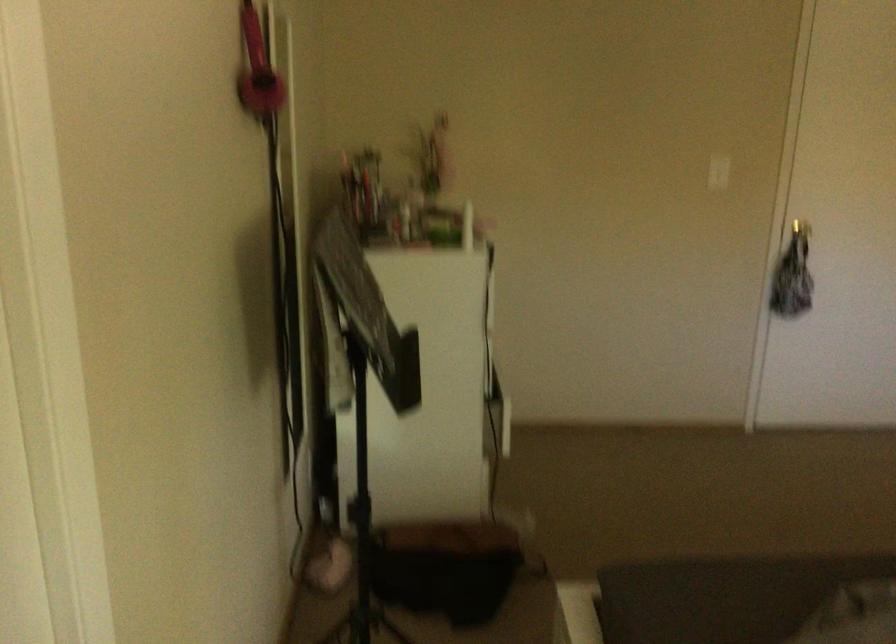
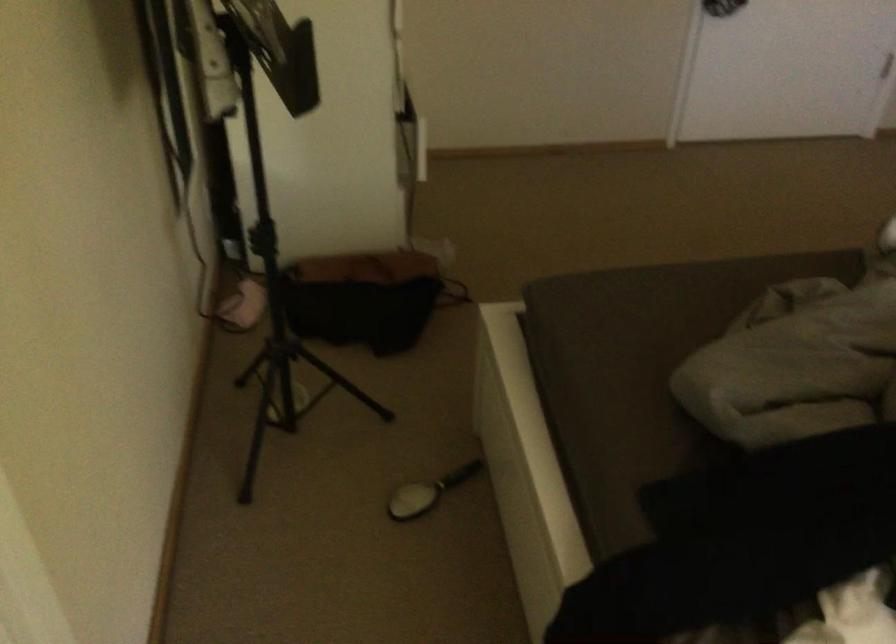
Question: What movement of the cameraman would produce the second image?

Choices:
 (A) Left
 (B) Right
 (C) Forward
 (D) Backward

Answer: (C)